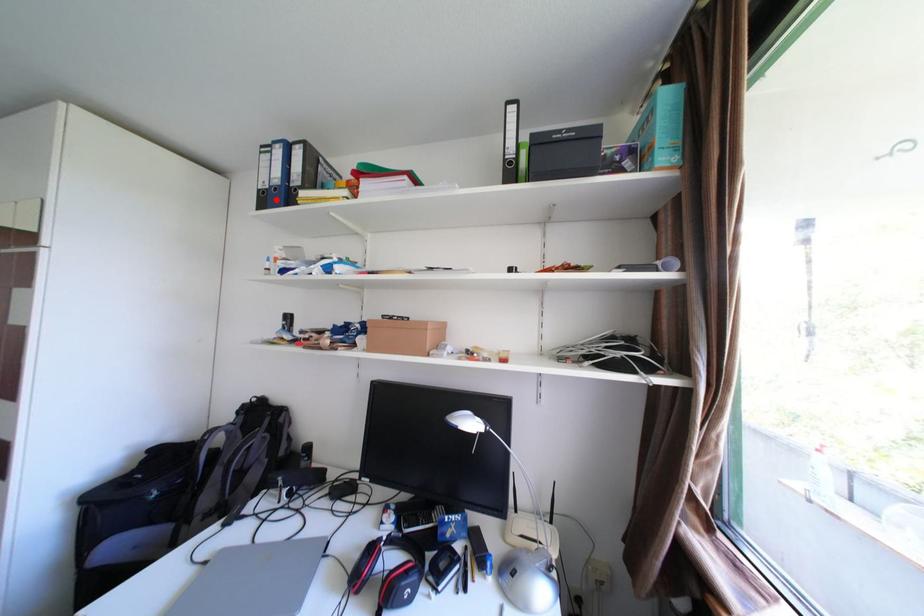
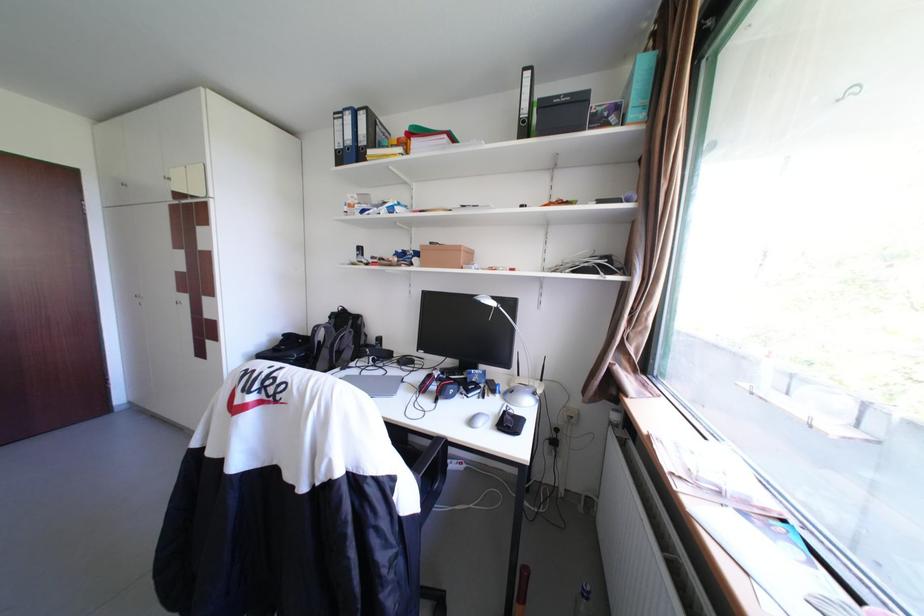
Locate, in the second image, the point that corresponds to the highlighted location in the first image.

(351, 158)